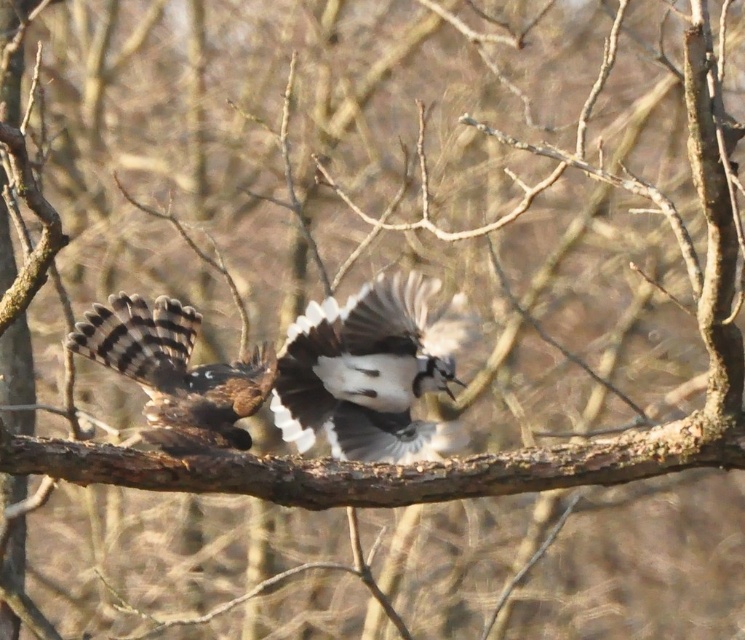
You are a birdwatcher observing the scene from the ground. You notice a white glossy bird at center. Can you determine its exact location based on the coordinates provided in the image?

The white glossy bird at center is located at point (367, 372).

You are a photographer aiming to capture a closeup shot of the bird at point point (410,387) and point (241,445). Which bird should you focus on to ensure it appears larger in your photo?

Point (410,387) is further to the viewer than point (241,445), so focusing on the bird at point (410,387) will make it appear larger in the photo.

You are a birdwatcher observing two birds in a tree. You see the white glossy bird at center and the brown speckled hawk at left. Which bird appears closer to you based on their positions in the scene?

The white glossy bird at center appears closer to you because it is further to the viewer than the brown speckled hawk at left.